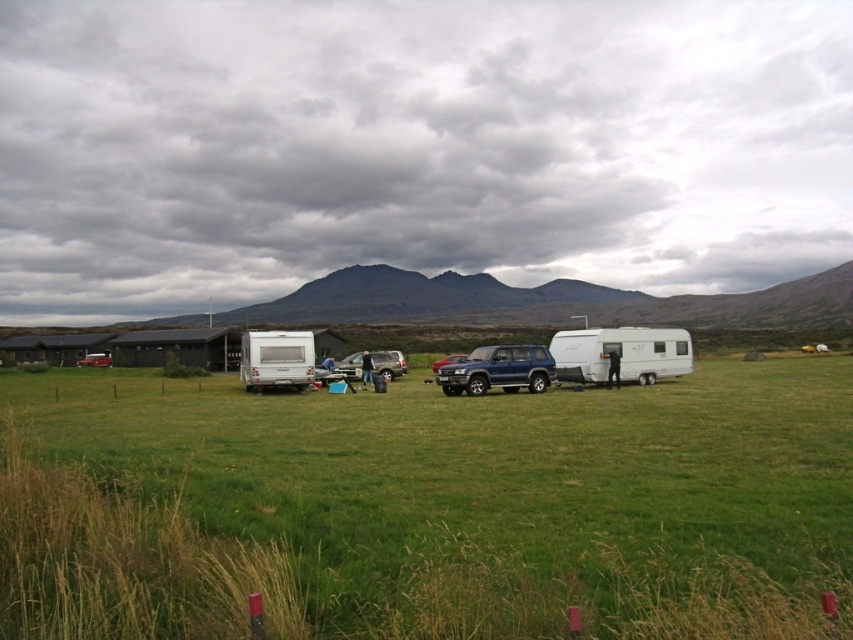
Question: Does white glossy trailer at right have a larger size compared to silver metallic camper at center-left?

Choices:
 (A) yes
 (B) no

Answer: (B)

Question: Based on their relative distances, which object is farther from the white glossy trailer at right?

Choices:
 (A) silver metallic camper at center-left
 (B) blue metallic suv at center
 (C) silver metallic van at center

Answer: (C)

Question: Which object appears closest to the camera in this image?

Choices:
 (A) silver metallic van at center
 (B) white glossy trailer at right

Answer: (B)

Question: Which of these objects is positioned closest to the silver metallic camper at center-left?

Choices:
 (A) silver metallic van at center
 (B) blue metallic suv at center

Answer: (A)

Question: Is blue metallic suv at center bigger than silver metallic camper at center-left?

Choices:
 (A) yes
 (B) no

Answer: (B)

Question: Can you confirm if green grassy field at center is wider than blue metallic suv at center?

Choices:
 (A) yes
 (B) no

Answer: (A)